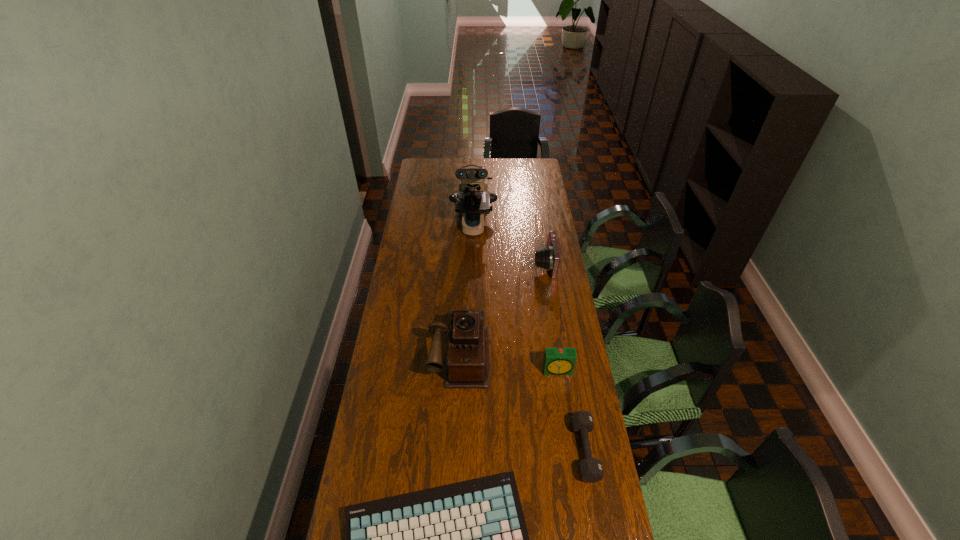
Image resolution: width=960 pixels, height=540 pixels. Find the location of `microscope`. microscope is located at coordinates tap(473, 199).

Where is `the second tallest object`? The image size is (960, 540). the second tallest object is located at coordinates (467, 353).

Image resolution: width=960 pixels, height=540 pixels. I want to click on camera, so click(548, 258).

Image resolution: width=960 pixels, height=540 pixels. Find the location of `alarm clock`. alarm clock is located at coordinates (557, 361).

Where is `the fifth tallest object`? Image resolution: width=960 pixels, height=540 pixels. the fifth tallest object is located at coordinates (590, 469).

Find the location of a particular element. The image size is (960, 540). vacant region located through the eyepieces of the microscope is located at coordinates (472, 271).

Locate an element on the screen. vacant region located on the horn of the fifth shortest object is located at coordinates (454, 494).

Where is `vacant space situated 0.200m on the front-facing side of the camera`? This screenshot has width=960, height=540. vacant space situated 0.200m on the front-facing side of the camera is located at coordinates (490, 264).

This screenshot has width=960, height=540. What are the coordinates of `free spot located on the front-facing side of the camera` in the screenshot? It's located at (454, 264).

Find the location of a particular element. This screenshot has width=960, height=540. vacant area located on the front-facing side of the camera is located at coordinates (461, 264).